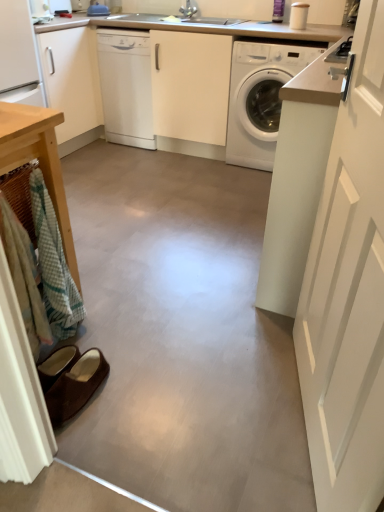
Find the location of a particular element. This screenshot has width=384, height=512. free spot to the right of wooden table at left is located at coordinates (139, 332).